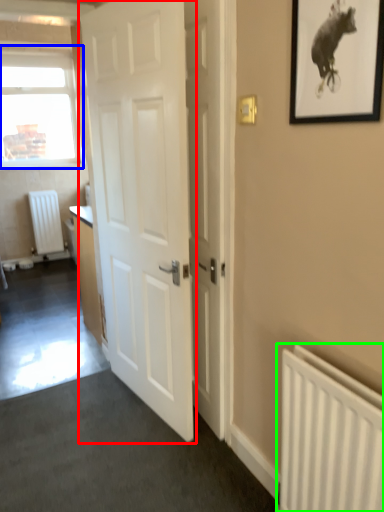
Question: Based on their relative distances, which object is nearer to door (highlighted by a red box)? Choose from window (highlighted by a blue box) and radiator (highlighted by a green box).

Choices:
 (A) window
 (B) radiator

Answer: (B)